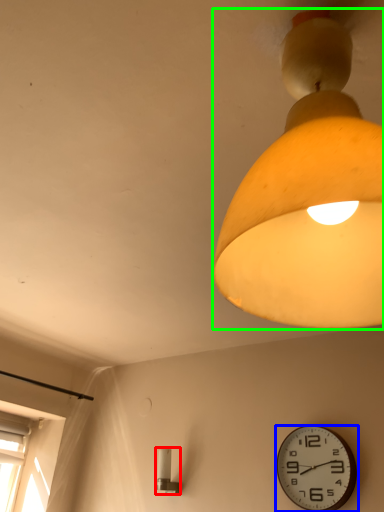
Question: Which object is positioned closest to lamp (highlighted by a red box)? Select from wall clock (highlighted by a blue box) and lamp (highlighted by a green box).

Choices:
 (A) wall clock
 (B) lamp

Answer: (A)